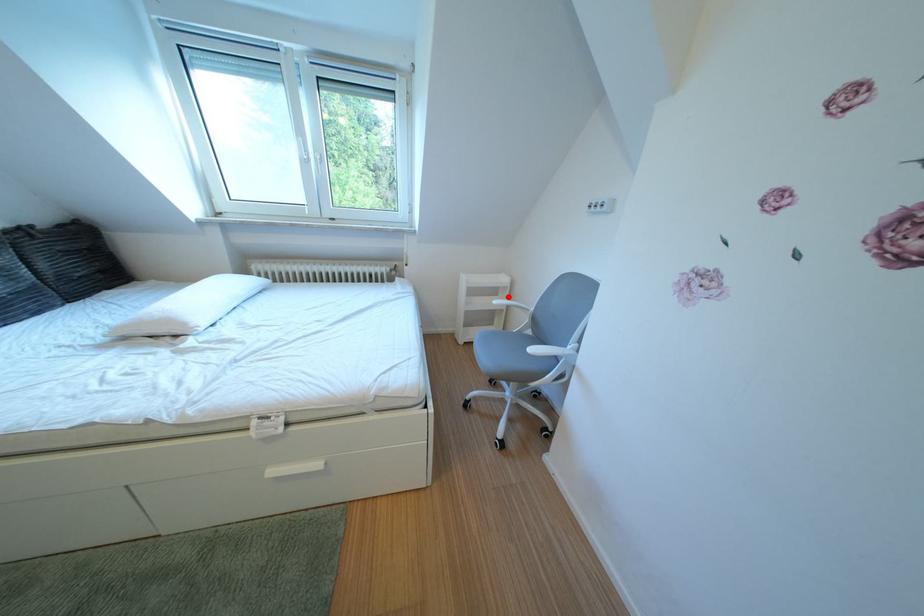
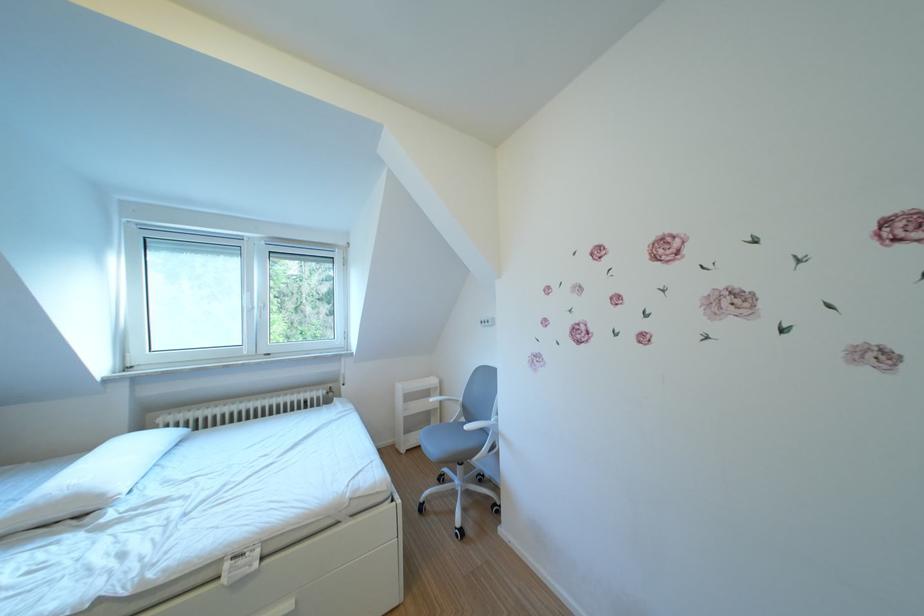
Find the pixel in the second image that matches the highlighted location in the first image.

(440, 399)